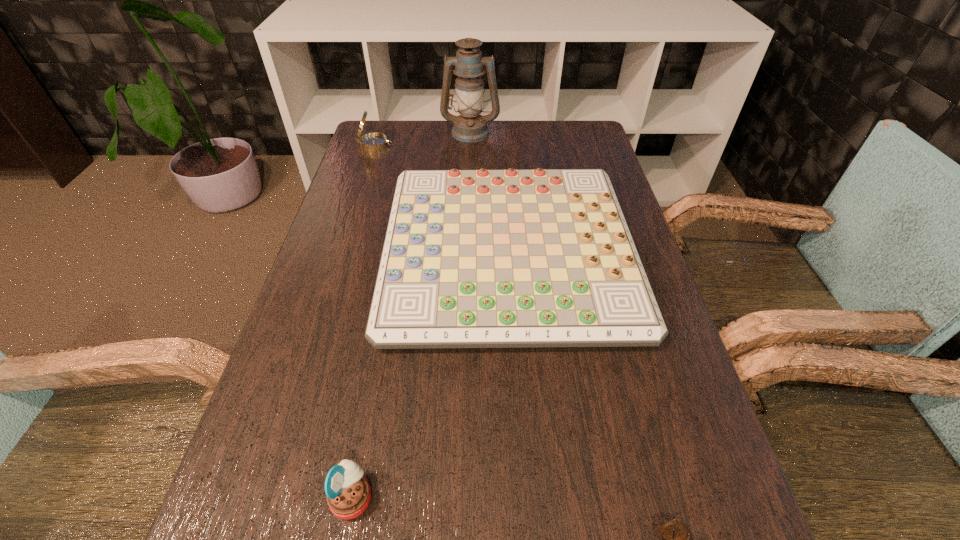
Find the location of `oil lamp that is positioned at the far edge`. oil lamp that is positioned at the far edge is located at coordinates (470, 126).

The width and height of the screenshot is (960, 540). In order to click on compass located at the far edge in this screenshot , I will do `click(374, 141)`.

This screenshot has height=540, width=960. Identify the location of compass situated at the left edge. tap(374, 141).

This screenshot has width=960, height=540. What are the coordinates of `muffin at the left edge` in the screenshot? It's located at (348, 493).

Identify the location of gameboard at the left edge. (516, 258).

Locate an element on the screen. object at the right edge is located at coordinates (516, 258).

You are a GUI agent. You are given a task and a screenshot of the screen. Output one action in this format:
    pyautogui.click(x=<x>, y=<y>)
    Task: Click on the object that is at the far left corner
    The height and width of the screenshot is (540, 960).
    Given the screenshot: What is the action you would take?
    tap(374, 141)

You are a GUI agent. You are given a task and a screenshot of the screen. Output one action in this format:
    pyautogui.click(x=<x>, y=<y>)
    Task: Click on the free space at the far edge
    
    Given the screenshot: What is the action you would take?
    coord(534,131)

In the image, there is a desktop. Where is `free space at the left edge`? free space at the left edge is located at coordinates (328, 305).

The width and height of the screenshot is (960, 540). In order to click on vacant space at the right edge of the desktop in this screenshot , I will do `click(626, 371)`.